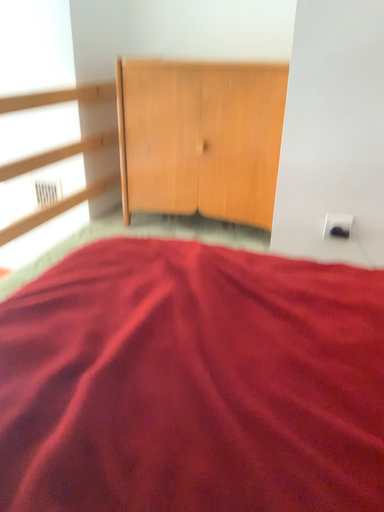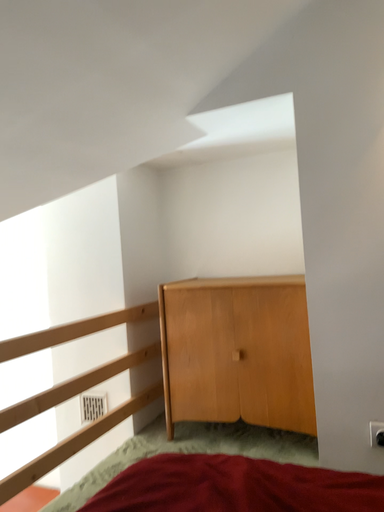
Question: Which way did the camera rotate in the video?

Choices:
 (A) rotated downward
 (B) rotated upward

Answer: (B)